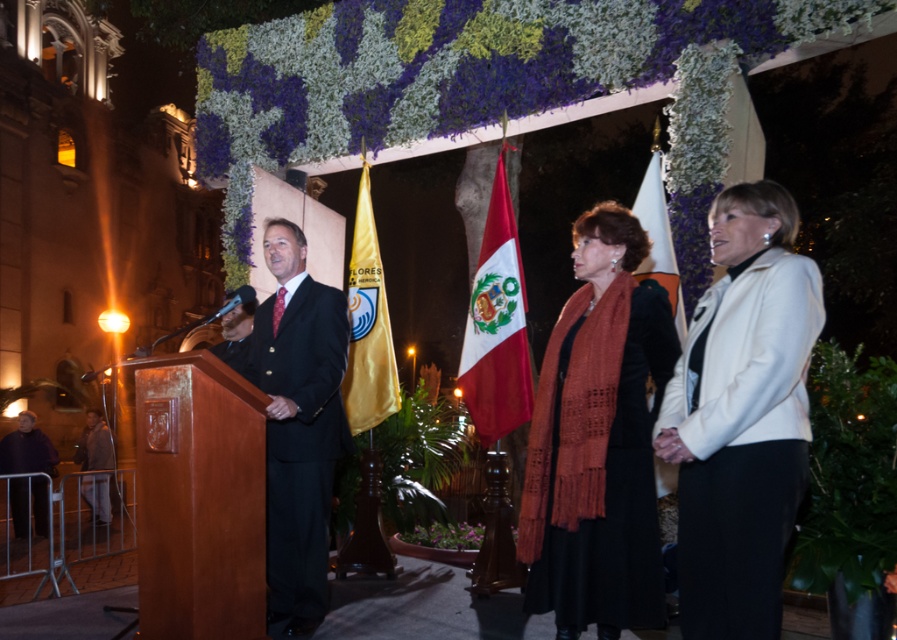
You are a photographer positioned behind the speaker at the podium. You want to take a photo that includes both the white matte jacket at upper right and the satin black suit at left. What is the minimum distance you need to step back to ensure both subjects are in frame?

The white matte jacket at upper right and the satin black suit at left are 2.33 meters apart. To include both in the frame, you need to step back at least 2.33 meters to ensure the camera can capture the entire distance between them.

You are an event planner observing the stage setup. You need to ensure that the white matte jacket at upper right and the satin black suit at left are visible to the audience. Based on their heights, which one might be more easily seen from the front row seats?

The white matte jacket at upper right is taller than the satin black suit at left, so it would be more easily seen from the front row seats.